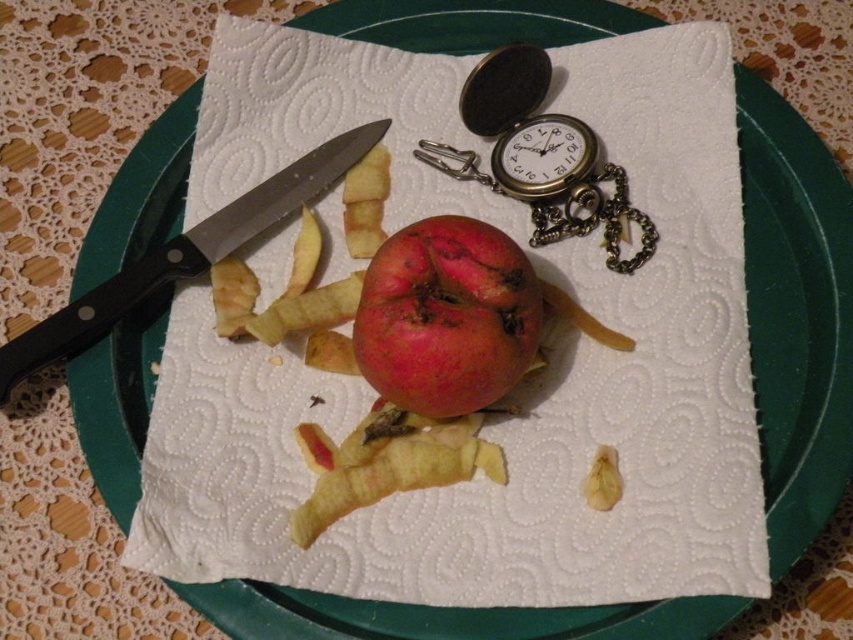
Between rotten red apple at center and antique brass pocket watch at upper center, which one has less height?

With less height is rotten red apple at center.

Can you confirm if rotten red apple at center is positioned below antique brass pocket watch at upper center?

Correct, rotten red apple at center is located below antique brass pocket watch at upper center.

Is point (474, 349) more distant than point (605, 228)?

No, (474, 349) is in front of (605, 228).

Where is `rotten red apple at center`? rotten red apple at center is located at coordinates (445, 316).

Can you confirm if antique brass pocket watch at upper center is positioned to the right of black plastic knife at upper left?

Indeed, antique brass pocket watch at upper center is positioned on the right side of black plastic knife at upper left.

Is antique brass pocket watch at upper center smaller than black plastic knife at upper left?

Yes, antique brass pocket watch at upper center is smaller than black plastic knife at upper left.

Is point (625, 188) in front of point (125, 310)?

No.

The width and height of the screenshot is (853, 640). I want to click on antique brass pocket watch at upper center, so click(540, 156).

Between rotten red apple at center and black plastic knife at upper left, which one has less height?

Standing shorter between the two is rotten red apple at center.

Who is positioned more to the right, rotten red apple at center or black plastic knife at upper left?

rotten red apple at center is more to the right.

Between point (444, 285) and point (178, 257), which one is positioned behind?

Positioned behind is point (178, 257).

Where is `rotten red apple at center`? rotten red apple at center is located at coordinates (445, 316).